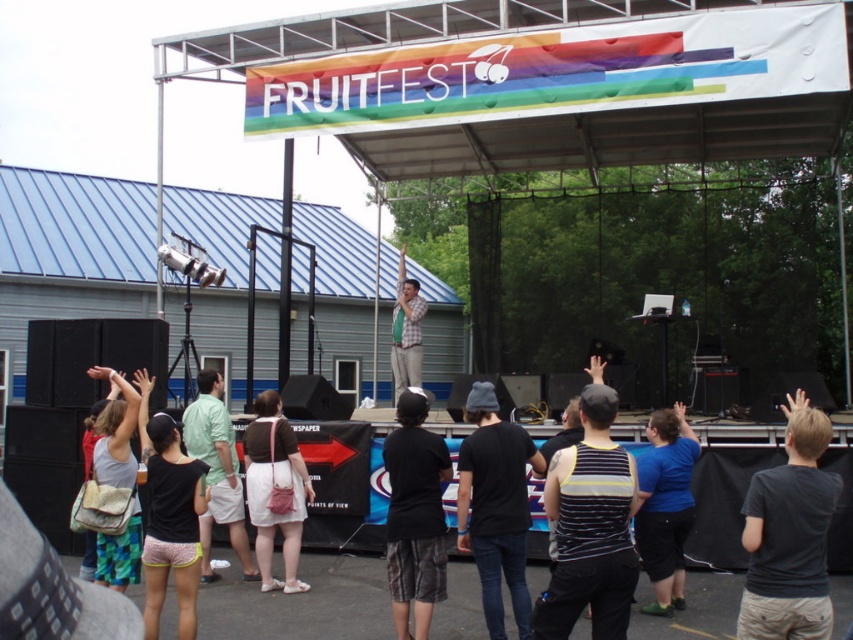
You are at the FruitFest event and want to find someone wearing a striped tank top at center. Based on the coordinates provided, where should you look relative to the stage?

The striped tank top at center is located at coordinates point (590, 528), which places it near the center of the image, slightly to the right and closer to the bottom. Since the stage is the main structure, you should look towards the central area of the event space, slightly to the right of the stage.

In the scene shown: You are a photographer at the FRUITFEST event and want to capture a photo of both the striped tank top at center and the light green fabric shirt at center. Which one should you focus on first if you want to include both in the frame without zooming in?

You should focus on the striped tank top at center first because it is smaller than the light green fabric shirt at center, allowing you to frame both by positioning the smaller one closer to the center of the image while accommodating the larger one in the shot.